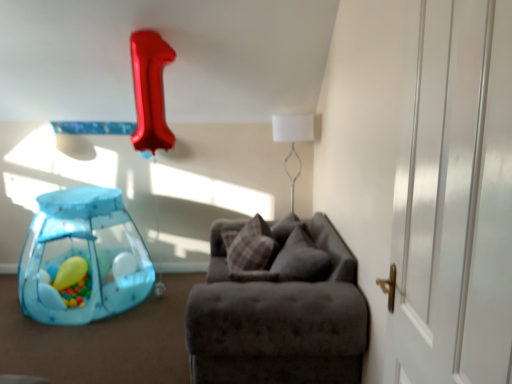
Question: Considering the relative positions of white fabric lampshade at upper center and transparent plastic playpen at lower left in the image provided, is white fabric lampshade at upper center behind transparent plastic playpen at lower left?

Choices:
 (A) no
 (B) yes

Answer: (B)

Question: Could you tell me if white fabric lampshade at upper center is facing transparent plastic playpen at lower left?

Choices:
 (A) no
 (B) yes

Answer: (A)

Question: From the image's perspective, would you say white fabric lampshade at upper center is positioned over transparent plastic playpen at lower left?

Choices:
 (A) yes
 (B) no

Answer: (A)

Question: Is white fabric lampshade at upper center shorter than transparent plastic playpen at lower left?

Choices:
 (A) no
 (B) yes

Answer: (A)

Question: From the image's perspective, is white fabric lampshade at upper center located beneath transparent plastic playpen at lower left?

Choices:
 (A) yes
 (B) no

Answer: (B)

Question: Looking at their shapes, would you say white glossy door at right is wider or thinner than white fabric lampshade at upper center?

Choices:
 (A) thin
 (B) wide

Answer: (A)

Question: Relative to white fabric lampshade at upper center, is white glossy door at right in front or behind?

Choices:
 (A) behind
 (B) front

Answer: (B)

Question: In the image, is white glossy door at right on the left side or the right side of white fabric lampshade at upper center?

Choices:
 (A) left
 (B) right

Answer: (B)

Question: From the image's perspective, is white glossy door at right above or below white fabric lampshade at upper center?

Choices:
 (A) below
 (B) above

Answer: (A)

Question: Looking at their shapes, would you say plaid fabric pillow at center, the 1th pillow positioned from the left, is wider or thinner than white glossy door at right?

Choices:
 (A) wide
 (B) thin

Answer: (A)

Question: Is plaid fabric pillow at center, the 1th pillow positioned from the left, inside or outside of white glossy door at right?

Choices:
 (A) outside
 (B) inside

Answer: (A)

Question: From the image's perspective, relative to white glossy door at right, is plaid fabric pillow at center, the 1th pillow positioned from the left, above or below?

Choices:
 (A) above
 (B) below

Answer: (B)

Question: Visually, is plaid fabric pillow at center, which is the 2th pillow from right to left, positioned to the left or to the right of white glossy door at right?

Choices:
 (A) right
 (B) left

Answer: (B)

Question: Which is correct: velvet gray pillow at center, which is the first pillow in right-to-left order, is inside suede-like gray couch at center, or outside of it?

Choices:
 (A) outside
 (B) inside

Answer: (B)

Question: From the image's perspective, is velvet gray pillow at center, arranged as the second pillow when viewed from the left, above or below suede-like gray couch at center?

Choices:
 (A) above
 (B) below

Answer: (A)